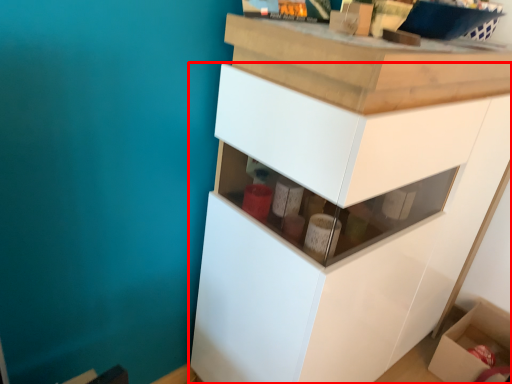
Question: Where is cabinetry (annotated by the red box) located in relation to cardboard box in the image?

Choices:
 (A) right
 (B) left

Answer: (B)